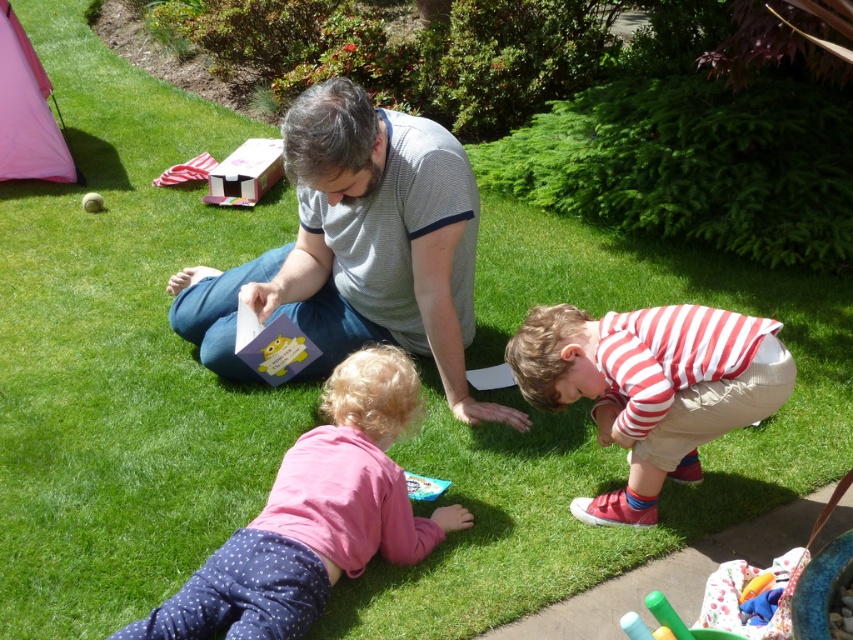
Is striped cotton shirt at lower right further to the viewer compared to white rubber tennis ball at upper left?

That is False.

Who is more forward, (560, 308) or (94, 204)?

Positioned in front is point (560, 308).

Does point (683, 369) come farther from viewer compared to point (82, 202)?

No, it is in front of (82, 202).

I want to click on striped cotton shirt at lower right, so click(651, 387).

Does gray striped shirt at center appear over plastic toy boat at lower center?

Yes.

Does point (271, 289) come in front of point (440, 490)?

That is False.

Who is more distant from viewer, (350, 296) or (434, 483)?

The point (350, 296) is more distant.

You are a GUI agent. You are given a task and a screenshot of the screen. Output one action in this format:
    pyautogui.click(x=<x>, y=<y>)
    Task: Click on the gray striped shirt at center
    This screenshot has width=853, height=640.
    Given the screenshot: What is the action you would take?
    pyautogui.click(x=358, y=248)

Between gray striped shirt at center and striped cotton shirt at lower right, which one has more height?

Standing taller between the two is gray striped shirt at center.

Is gray striped shirt at center above striped cotton shirt at lower right?

Yes, gray striped shirt at center is above striped cotton shirt at lower right.

Where is `gray striped shirt at center`? The width and height of the screenshot is (853, 640). gray striped shirt at center is located at coordinates (358, 248).